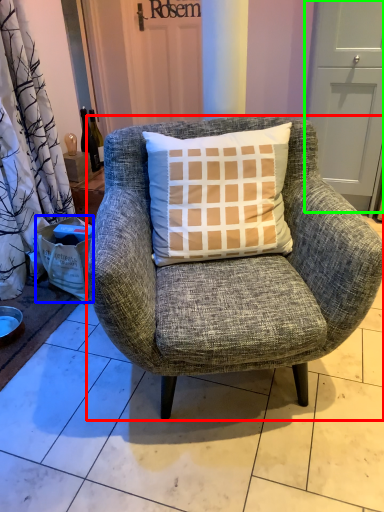
Question: Estimate the real-world distances between objects in this image. Which object is farther from chair (highlighted by a red box), box (highlighted by a blue box) or screen door (highlighted by a green box)?

Choices:
 (A) box
 (B) screen door

Answer: (B)